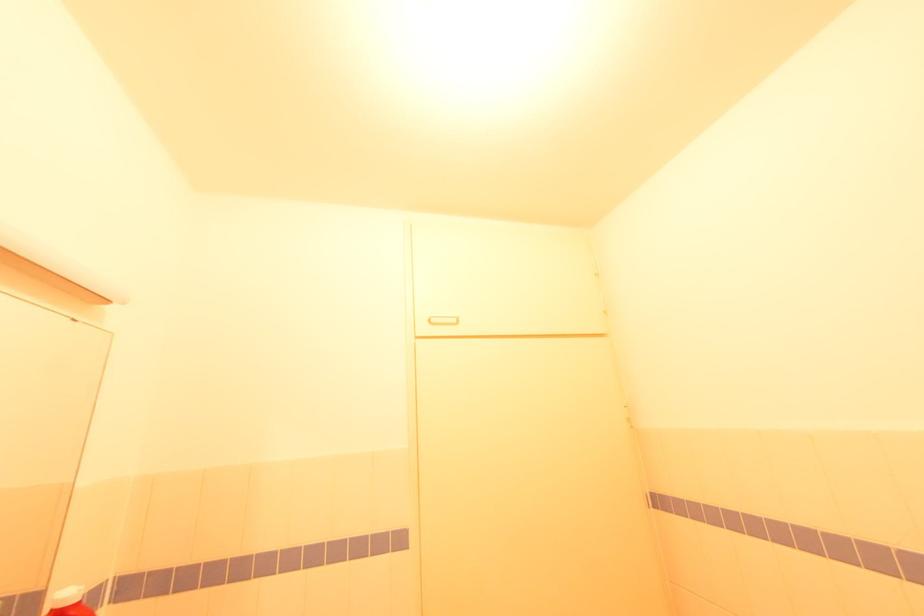
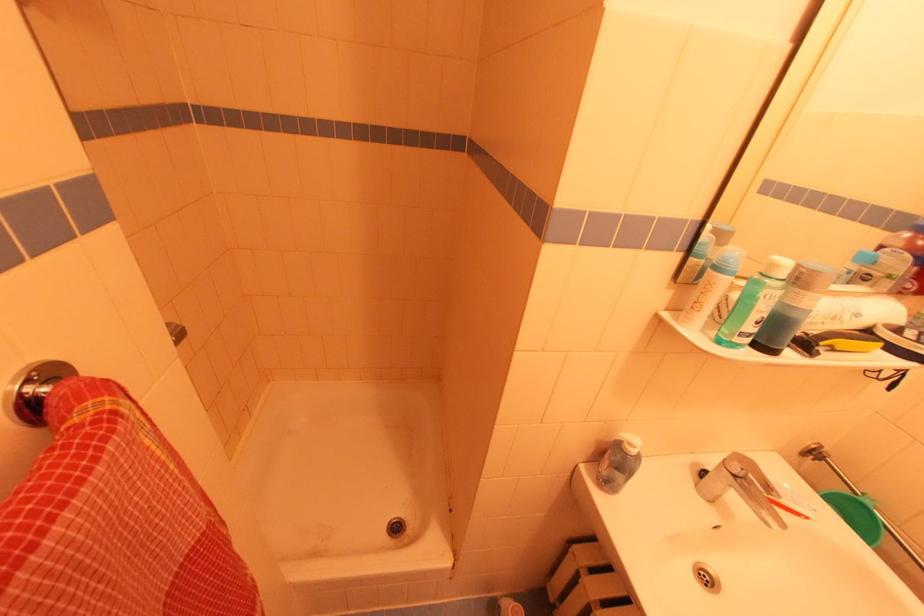
How did the camera likely rotate?

The rotation direction of the camera is left-down.